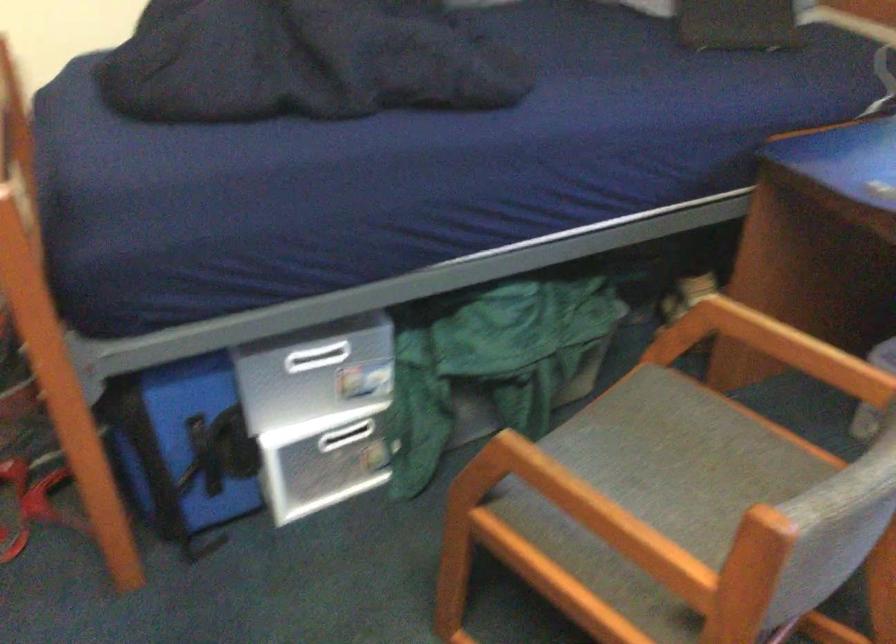
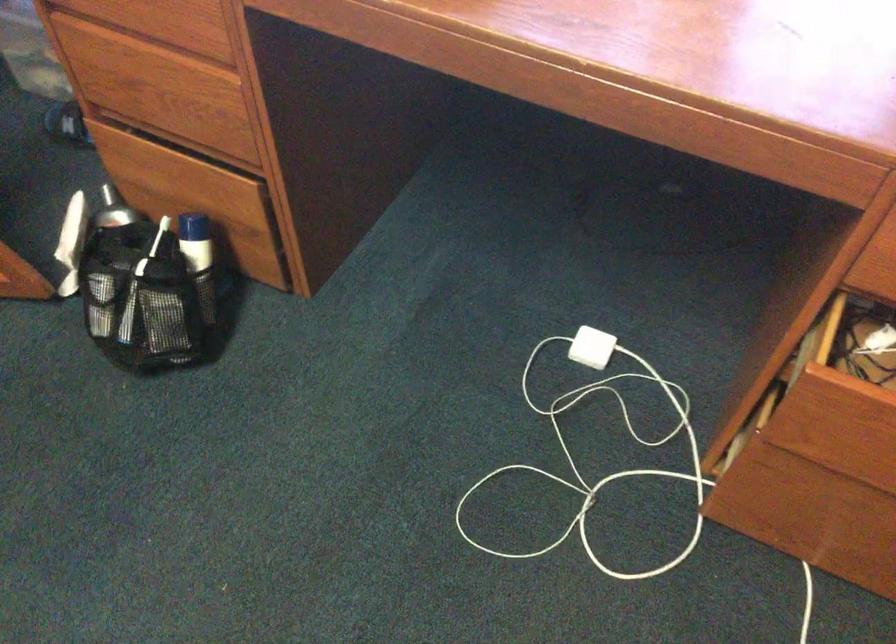
The first image is from the beginning of the video and the second image is from the end. How did the camera likely rotate when shooting the video?

The rotation direction of the camera is right-down.